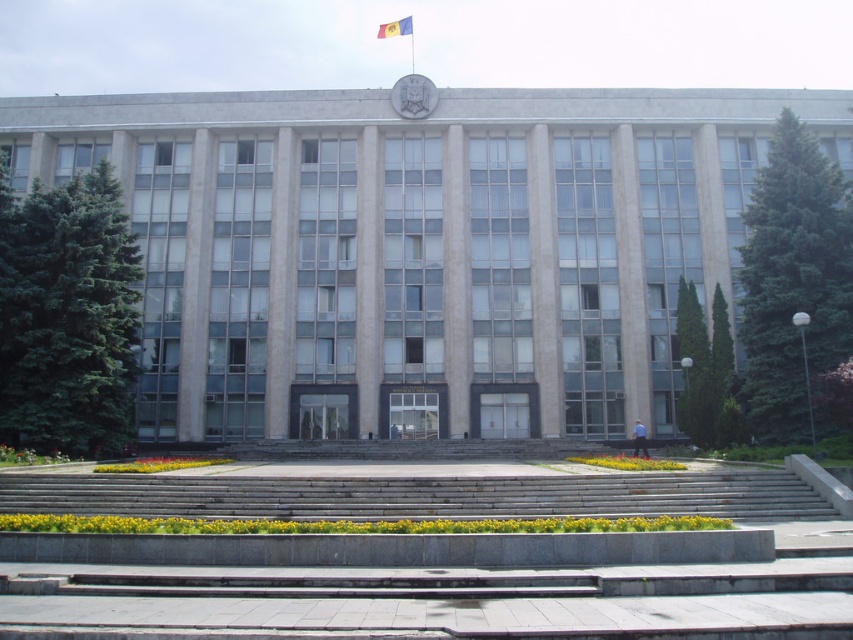
Question: From the image, what is the correct spatial relationship of matte gray emblem at center in relation to blue fabric flag at upper center?

Choices:
 (A) below
 (B) above

Answer: (A)

Question: Based on their relative distances, which object is farther from the blue fabric flag at upper center?

Choices:
 (A) matte gray emblem at center
 (B) gray concrete stairs at center

Answer: (B)

Question: Considering the real-world distances, which object is closest to the matte gray emblem at center?

Choices:
 (A) blue fabric flag at upper center
 (B) gray concrete stairs at center

Answer: (B)

Question: Does matte gray emblem at center have a smaller size compared to blue fabric flag at upper center?

Choices:
 (A) yes
 (B) no

Answer: (A)

Question: Which object is positioned closest to the blue fabric flag at upper center?

Choices:
 (A) matte gray emblem at center
 (B) gray concrete stairs at center

Answer: (A)

Question: Does gray concrete stairs at center appear over blue fabric flag at upper center?

Choices:
 (A) no
 (B) yes

Answer: (A)